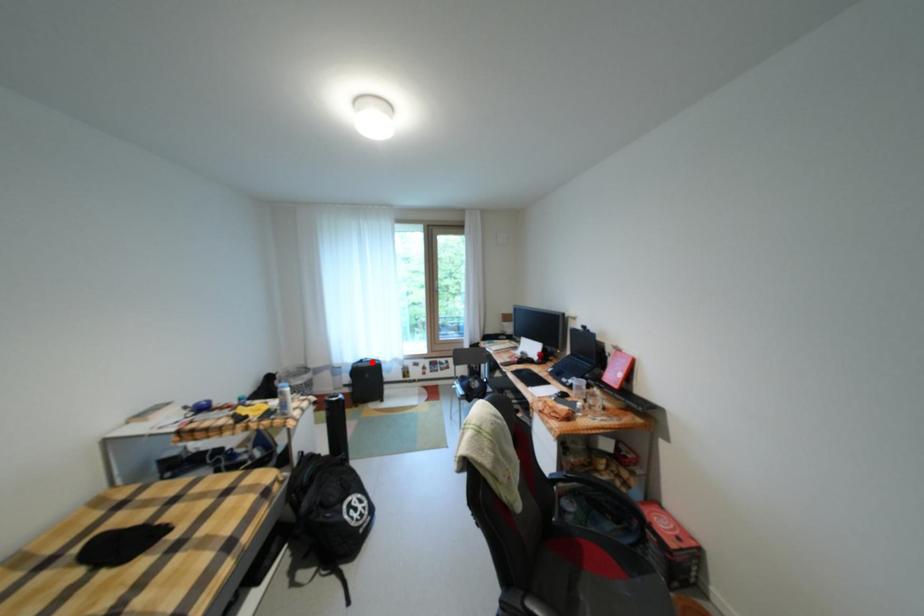
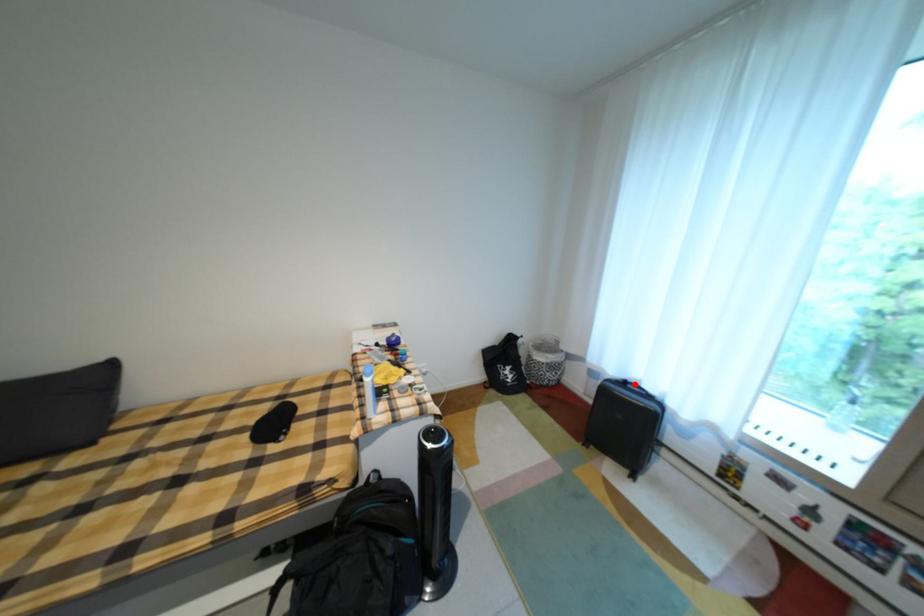
I am providing you with two images of the same scene from different viewpoints. A red point is marked on the first image and another point is marked on the second image. Is the marked point in image1 the same physical position as the marked point in image2?

Yes